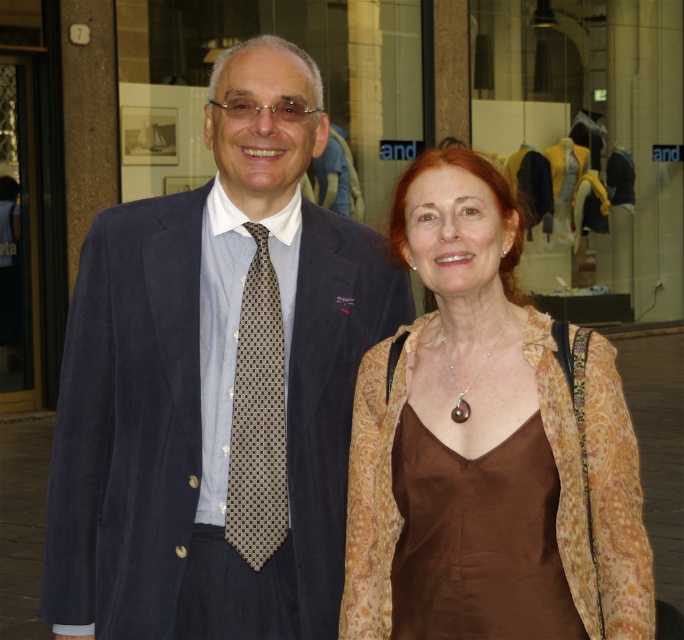
You are a photographer setting up for a photoshoot in a studio. You have two outfits to photograph today. The first is the suede suit at center and the second is the brown silk dress at center. The studio has a limited space between the camera and the backdrop. The space is exactly 1.2 meters wide. Can both outfits be placed side by side within this space without overlapping?

The suede suit at center is positioned on the left side of brown silk dress at center. However, the width of the space is 1.2 meters. Without specific measurements of the outfits, it is impossible to determine if they can fit side by side.